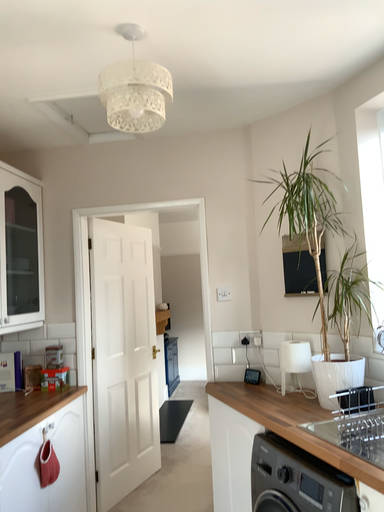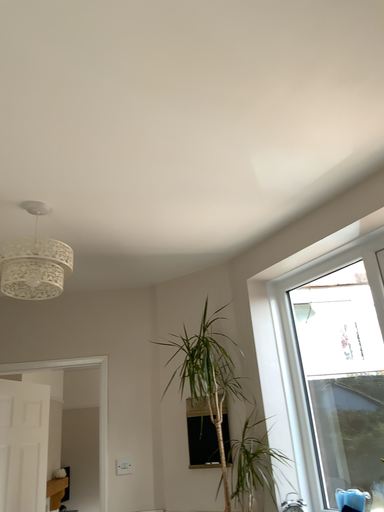
Question: Which way did the camera rotate in the video?

Choices:
 (A) rotated upward
 (B) rotated downward

Answer: (A)